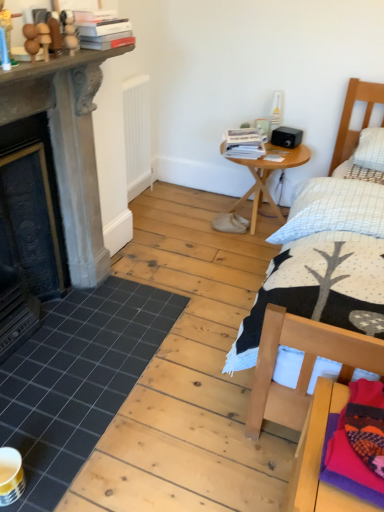
Question: Is knitted woolen blanket at lower right not inside wooden round table at center?

Choices:
 (A) yes
 (B) no

Answer: (A)

Question: Is knitted woolen blanket at lower right closer to camera compared to wooden round table at center?

Choices:
 (A) no
 (B) yes

Answer: (B)

Question: Are knitted woolen blanket at lower right and wooden round table at center making contact?

Choices:
 (A) no
 (B) yes

Answer: (A)

Question: From the image's perspective, is knitted woolen blanket at lower right over wooden round table at center?

Choices:
 (A) no
 (B) yes

Answer: (A)

Question: Is knitted woolen blanket at lower right at the left side of wooden round table at center?

Choices:
 (A) yes
 (B) no

Answer: (B)

Question: From a real-world perspective, is knitted woolen blanket at lower right located beneath wooden round table at center?

Choices:
 (A) no
 (B) yes

Answer: (A)

Question: Is white paper stack at upper right, which ranks as the first book in back-to-front order, a part of wooden round table at center?

Choices:
 (A) no
 (B) yes

Answer: (A)

Question: Is wooden round table at center positioned behind white paper stack at upper right, which ranks as the first book in back-to-front order?

Choices:
 (A) yes
 (B) no

Answer: (B)

Question: Considering the relative positions of wooden round table at center and white paper stack at upper right, placed as the third book when sorted from left to right, in the image provided, is wooden round table at center to the right of white paper stack at upper right, placed as the third book when sorted from left to right, from the viewer's perspective?

Choices:
 (A) yes
 (B) no

Answer: (A)

Question: Can you confirm if wooden round table at center is thinner than white paper stack at upper right, which ranks as the first book in back-to-front order?

Choices:
 (A) no
 (B) yes

Answer: (A)

Question: Is wooden round table at center aimed at white paper stack at upper right, which ranks as the first book in back-to-front order?

Choices:
 (A) no
 (B) yes

Answer: (A)

Question: From a real-world perspective, is wooden round table at center beneath white paper stack at upper right, positioned as the 3th book in front-to-back order?

Choices:
 (A) no
 (B) yes

Answer: (B)

Question: Is black tile at lower left located outside wooden bed at right?

Choices:
 (A) yes
 (B) no

Answer: (A)